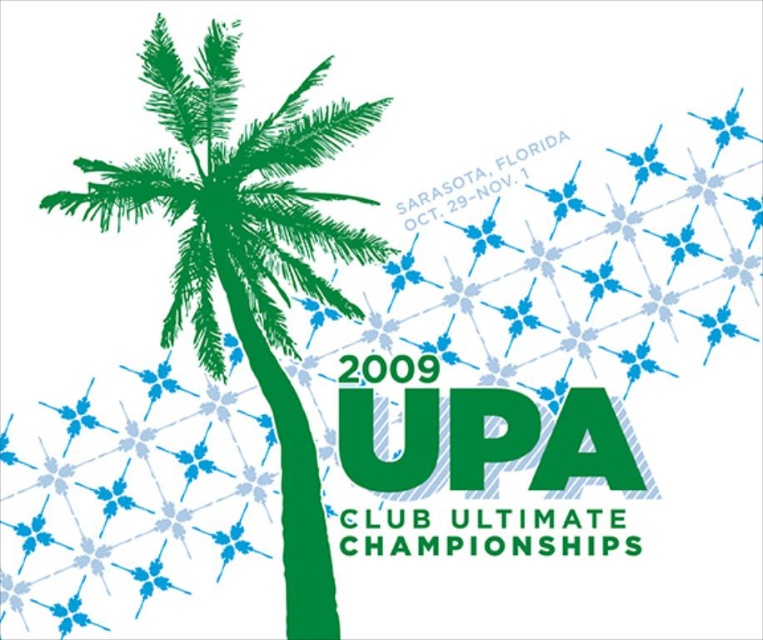
You are designing a poster and need to ensure the green ink palm tree at left and the green matte upa logo at center are visible. Which object should you prioritize in terms of size to maintain visual hierarchy?

The green ink palm tree at left is wider than the green matte upa logo at center, so prioritizing its size will maintain visual hierarchy as it already dominates the composition.